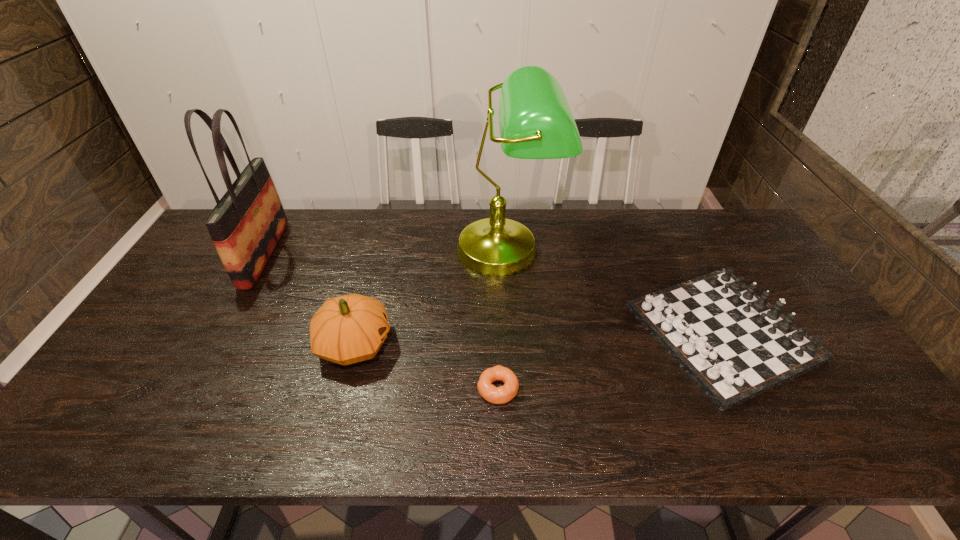
Locate an element on the screen. Image resolution: width=960 pixels, height=540 pixels. blank area in the image that satisfies the following two spatial constraints: 1. on the side of the third tallest object with the carved face; 2. on the right side of the shortest object is located at coordinates (343, 389).

You are a GUI agent. You are given a task and a screenshot of the screen. Output one action in this format:
    pyautogui.click(x=<x>, y=<y>)
    Task: Click on the free region that satisfies the following two spatial constraints: 1. on the desk next to the lamp; 2. on the front-facing side of the shopping bag
    The width and height of the screenshot is (960, 540).
    Given the screenshot: What is the action you would take?
    pyautogui.click(x=507, y=254)

Identify the location of free space in the image that satisfies the following two spatial constraints: 1. on the side of the gourd with the carved face; 2. on the left side of the doughnut. The image size is (960, 540). (343, 389).